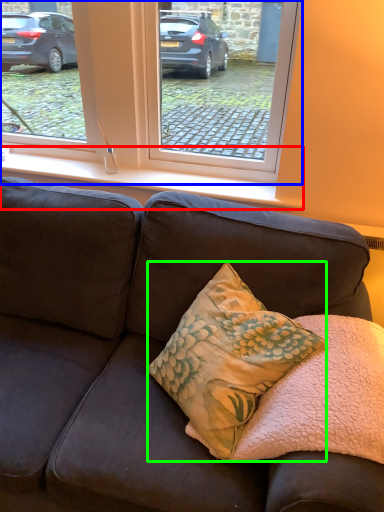
Question: Estimate the real-world distances between objects in this image. Which object is closer to window sill (highlighted by a red box), window (highlighted by a blue box) or pillow (highlighted by a green box)?

Choices:
 (A) window
 (B) pillow

Answer: (A)